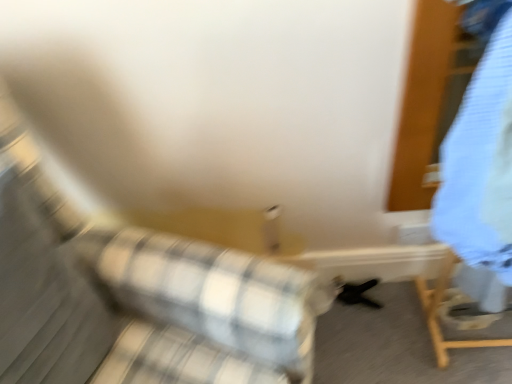
Question: From a real-world perspective, is plaid fabric couch at center physically located above or below light blue fabric at right?

Choices:
 (A) below
 (B) above

Answer: (A)

Question: Does point (237, 332) appear closer or farther from the camera than point (504, 97)?

Choices:
 (A) farther
 (B) closer

Answer: (A)

Question: Relative to light blue fabric at right, is plaid fabric couch at center in front or behind?

Choices:
 (A) front
 (B) behind

Answer: (A)

Question: Considering the relative positions of light blue fabric at right and plaid fabric couch at center in the image provided, is light blue fabric at right to the left or to the right of plaid fabric couch at center?

Choices:
 (A) right
 (B) left

Answer: (A)

Question: Is light blue fabric at right taller or shorter than plaid fabric couch at center?

Choices:
 (A) short
 (B) tall

Answer: (A)

Question: From a real-world perspective, is light blue fabric at right physically located above or below plaid fabric couch at center?

Choices:
 (A) above
 (B) below

Answer: (A)

Question: Considering their positions, is light blue fabric at right located in front of or behind plaid fabric couch at center?

Choices:
 (A) behind
 (B) front

Answer: (A)